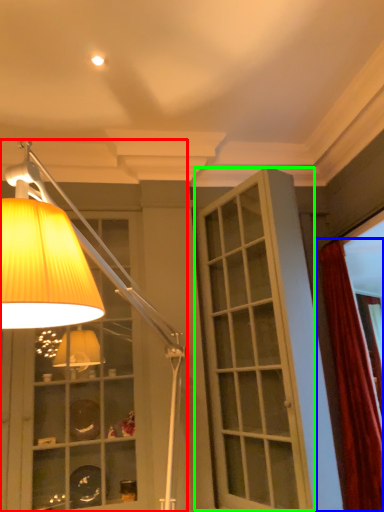
Question: Which object is the closest to the lamp (highlighted by a red box)? Choose among these: curtain (highlighted by a blue box) or screen door (highlighted by a green box).

Choices:
 (A) curtain
 (B) screen door

Answer: (B)